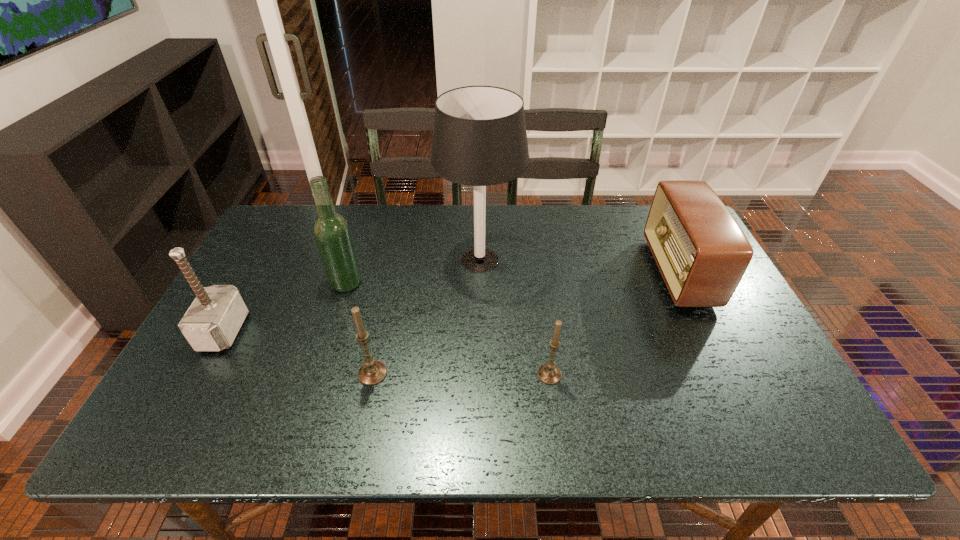
You are a GUI agent. You are given a task and a screenshot of the screen. Output one action in this format:
    pyautogui.click(x=<x>, y=<y>)
    Task: Click on the table lamp located at the far edge
    The width and height of the screenshot is (960, 540).
    Given the screenshot: What is the action you would take?
    pyautogui.click(x=479, y=139)

Image resolution: width=960 pixels, height=540 pixels. I want to click on object positioned at the left edge, so click(211, 323).

Locate an element on the screen. This screenshot has width=960, height=540. object at the right edge is located at coordinates (701, 252).

Find the location of a particular element. The image size is (960, 540). object at the far right corner is located at coordinates (701, 252).

At what (x,y) coordinates should I click in order to perform the action: click on free region at the far edge of the desktop. Please return your answer as a coordinate pair (x, y). Image resolution: width=960 pixels, height=540 pixels. Looking at the image, I should click on pos(473,207).

Find the location of a particular element. This screenshot has height=540, width=960. free space at the near edge is located at coordinates (496, 378).

In the image, there is a desktop. Where is `vacant space at the left edge`? vacant space at the left edge is located at coordinates (292, 260).

Identify the location of free region at the right edge of the desktop. This screenshot has height=540, width=960. (713, 325).

Find the location of a particular element. This screenshot has height=540, width=960. vacant area at the far left corner is located at coordinates (278, 230).

Find the location of a particular element. free point at the near left corner is located at coordinates [236, 382].